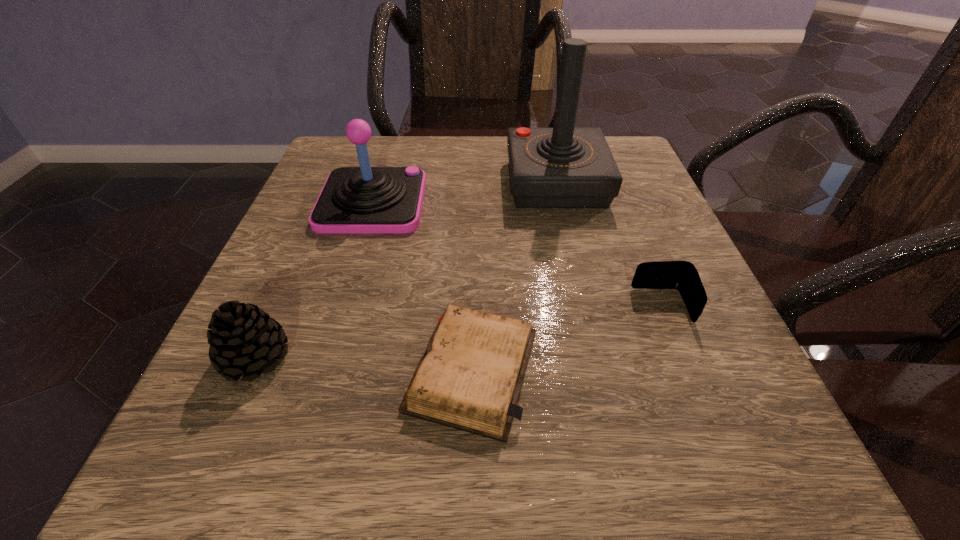
I want to click on empty location between the wallet and the shortest object, so click(x=567, y=338).

At what (x,y) coordinates should I click in order to perform the action: click on unoccupied area between the diary and the wallet. Please return your answer as a coordinate pair (x, y). Image resolution: width=960 pixels, height=540 pixels. Looking at the image, I should click on (567, 338).

This screenshot has height=540, width=960. In order to click on empty space that is in between the taller joystick and the wallet in this screenshot , I will do `click(610, 245)`.

Identify the location of free space that is in between the shortest object and the fourth tallest object. The height and width of the screenshot is (540, 960). (567, 338).

Choose which object is the nearest neighbor to the third shortest object. Please provide its 2D coordinates. Your answer should be formatted as a tuple, i.e. [(x, y)], where the tuple contains the x and y coordinates of a point satisfying the conditions above.

[(470, 376)]

The image size is (960, 540). What are the coordinates of `object that is the closest to the third shortest object` in the screenshot? It's located at (470, 376).

Locate an element on the screen. free space that satisfies the following two spatial constraints: 1. on the rectangular base of the tallest object; 2. at the narrow end of the third tallest object is located at coordinates (596, 357).

What are the coordinates of `free spot that satisfies the following two spatial constraints: 1. on the outer surface of the second shortest object; 2. on the front side of the diary` in the screenshot? It's located at (688, 370).

Locate an element on the screen. This screenshot has width=960, height=540. vacant space that satisfies the following two spatial constraints: 1. forward from the base of the second tallest object; 2. on the right side of the diary is located at coordinates click(x=321, y=370).

At what (x,y) coordinates should I click in order to perform the action: click on vacant region that satisfies the following two spatial constraints: 1. on the rectangular base of the tallest object; 2. forward from the base of the left joystick. Please return your answer as a coordinate pair (x, y). The height and width of the screenshot is (540, 960). Looking at the image, I should click on 561,202.